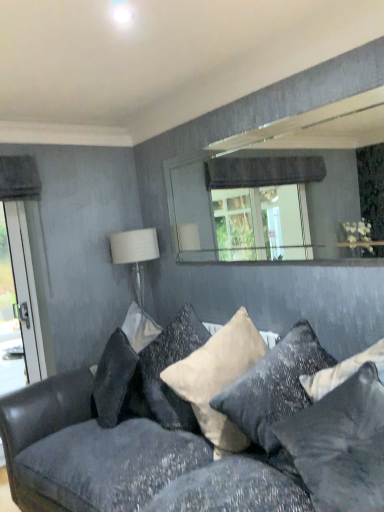
Question: Does beige velvet pillow at center, which appears as the second pillow when viewed from the front, appear on the right side of white fabric lampshade at upper right?

Choices:
 (A) yes
 (B) no

Answer: (A)

Question: Is beige velvet pillow at center, which is the 2th pillow in back-to-front order, not near white fabric lampshade at upper right?

Choices:
 (A) no
 (B) yes

Answer: (B)

Question: From a real-world perspective, is beige velvet pillow at center, which is the 2th pillow in back-to-front order, below white fabric lampshade at upper right?

Choices:
 (A) yes
 (B) no

Answer: (A)

Question: Does beige velvet pillow at center, which appears as the second pillow when viewed from the front, have a lesser height compared to white fabric lampshade at upper right?

Choices:
 (A) no
 (B) yes

Answer: (B)

Question: Is beige velvet pillow at center, which appears as the second pillow when viewed from the front, closer to camera compared to white fabric lampshade at upper right?

Choices:
 (A) yes
 (B) no

Answer: (A)

Question: Is white velvet pillow at center, which is the first pillow from back to front, in front of or behind beige velvet pillow at center, which is the 2th pillow in back-to-front order, in the image?

Choices:
 (A) front
 (B) behind

Answer: (B)

Question: In terms of height, does white velvet pillow at center, which is the third pillow in front-to-back order, look taller or shorter compared to beige velvet pillow at center, which is the 2th pillow in back-to-front order?

Choices:
 (A) tall
 (B) short

Answer: (B)

Question: In terms of size, does white velvet pillow at center, which is the third pillow in front-to-back order, appear bigger or smaller than beige velvet pillow at center, which is the 2th pillow in back-to-front order?

Choices:
 (A) big
 (B) small

Answer: (B)

Question: Visually, is white velvet pillow at center, which is the first pillow from back to front, positioned to the left or to the right of beige velvet pillow at center, which is the 2th pillow in back-to-front order?

Choices:
 (A) right
 (B) left

Answer: (B)

Question: In terms of size, does velvet dark gray couch at lower center appear bigger or smaller than white fabric lampshade at upper right?

Choices:
 (A) big
 (B) small

Answer: (A)

Question: From the image's perspective, is velvet dark gray couch at lower center located above or below white fabric lampshade at upper right?

Choices:
 (A) below
 (B) above

Answer: (A)

Question: From a real-world perspective, is velvet dark gray couch at lower center above or below white fabric lampshade at upper right?

Choices:
 (A) above
 (B) below

Answer: (B)

Question: Would you say velvet dark gray couch at lower center is to the left or to the right of white fabric lampshade at upper right in the picture?

Choices:
 (A) right
 (B) left

Answer: (A)

Question: From a real-world perspective, relative to velvet dark gray couch at lower center, is beige velvet pillow at center, which appears as the second pillow when viewed from the front, vertically above or below?

Choices:
 (A) above
 (B) below

Answer: (A)

Question: From the image's perspective, is beige velvet pillow at center, which is the 2th pillow in back-to-front order, located above or below velvet dark gray couch at lower center?

Choices:
 (A) below
 (B) above

Answer: (B)